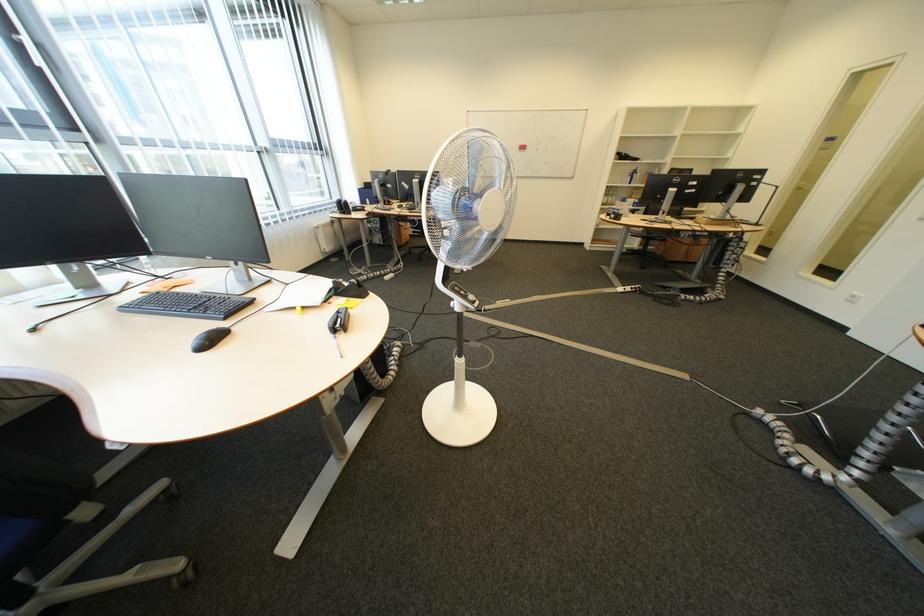
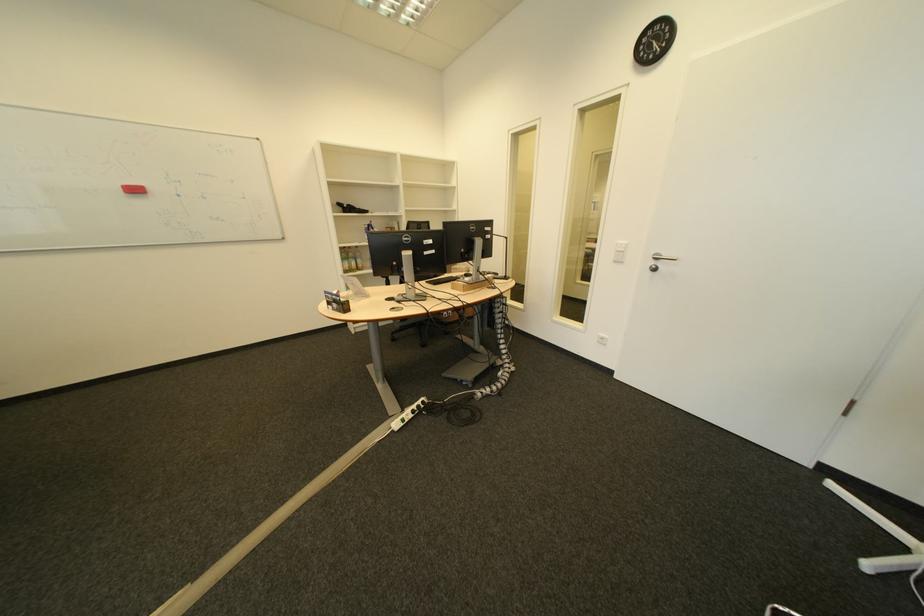
In the second image, find the point that corresponds to [622,193] in the first image.

(360, 254)